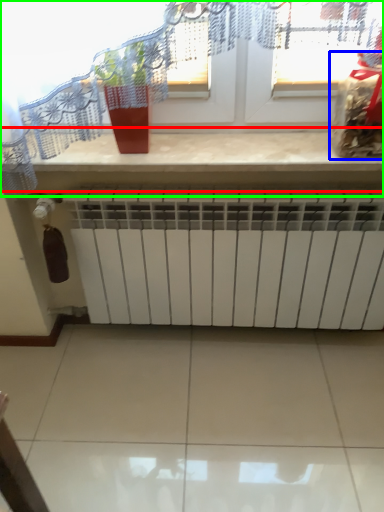
Question: Estimate the real-world distances between objects in this image. Which object is farther from counter top (highlighted by a red box), food (highlighted by a blue box) or window (highlighted by a green box)?

Choices:
 (A) food
 (B) window

Answer: (A)